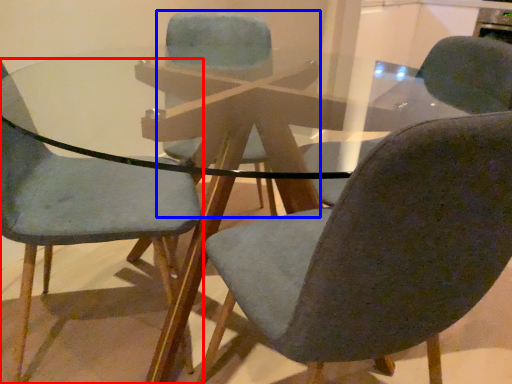
Question: Which object appears farthest to the camera in this image, chair (highlighted by a red box) or chair (highlighted by a blue box)?

Choices:
 (A) chair
 (B) chair

Answer: (B)